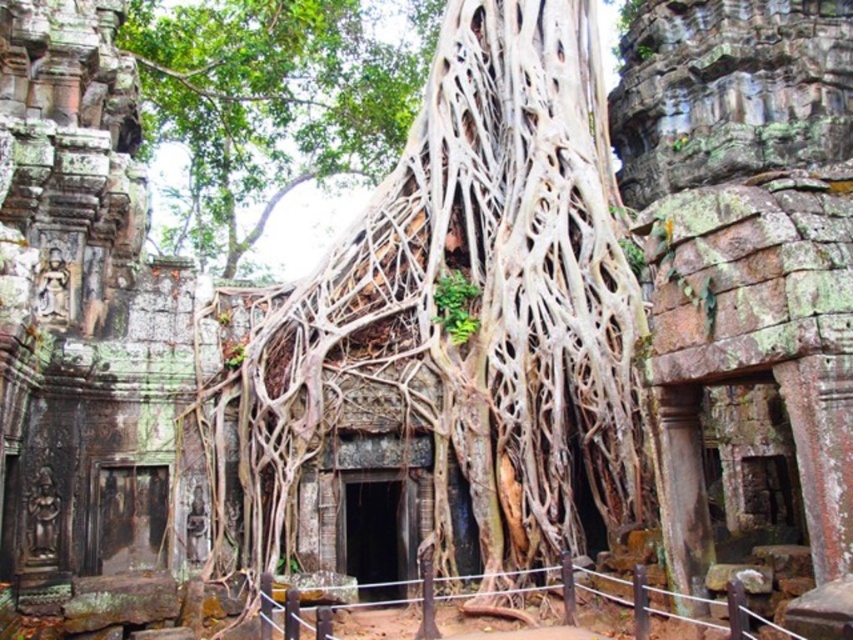
Question: Is brown textured roots at center smaller than green leafy tree at center?

Choices:
 (A) no
 (B) yes

Answer: (B)

Question: Among these objects, which one is nearest to the camera?

Choices:
 (A) brown textured roots at center
 (B) green leafy tree at center

Answer: (A)

Question: Does brown textured roots at center have a greater width compared to green leafy tree at center?

Choices:
 (A) no
 (B) yes

Answer: (A)

Question: Which point is farther from the camera taking this photo?

Choices:
 (A) (590, 292)
 (B) (357, 88)

Answer: (B)

Question: Which point appears farthest from the camera in this image?

Choices:
 (A) (248, 573)
 (B) (346, 118)

Answer: (B)

Question: Can you confirm if brown textured roots at center is wider than green leafy tree at center?

Choices:
 (A) yes
 (B) no

Answer: (B)